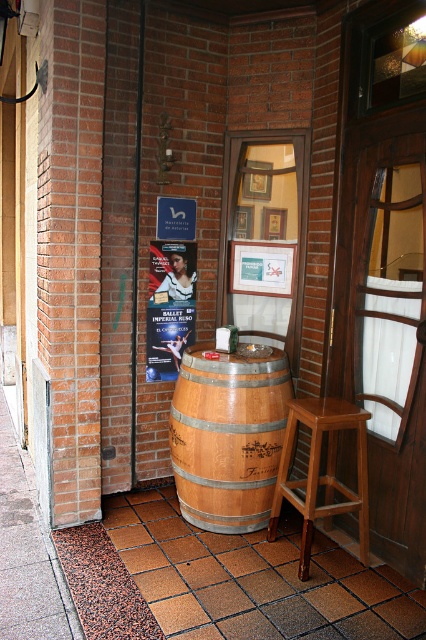
You are standing at the entrance of the brick building and want to place a small potted plant between the brown tile pavement at lower center and the light brown wooden bar stool at center. Based on their positions, where should you position the plant?

Since the brown tile pavement at lower center is to the left of the light brown wooden bar stool at center, you should place the plant between them along the same horizontal line, positioning it to the right of the brown tile pavement at lower center and to the left of the light brown wooden bar stool at center.

You are a delivery person who needs to place a heavy box on a surface. You see a wooden barrel at center and a matte paper poster at center in the scene. Which object can you place the box on?

The wooden barrel at center is positioned under the matte paper poster at center, so the box can be placed on the wooden barrel at center since it is a stable surface, while the matte paper poster at center is likely mounted on the wall and not suitable for placing heavy items.